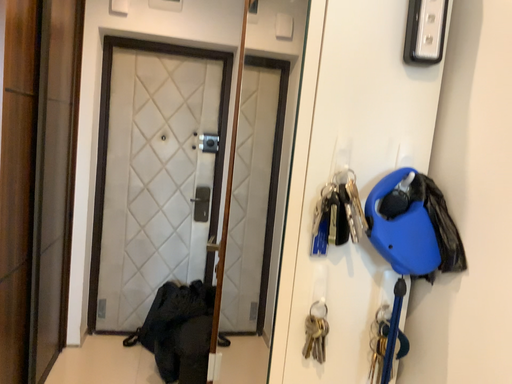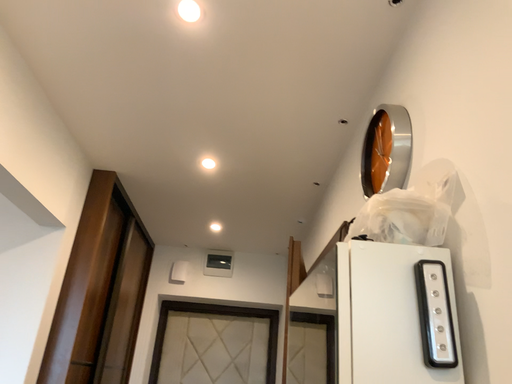
Question: Which way did the camera rotate in the video?

Choices:
 (A) rotated left
 (B) rotated right

Answer: (A)